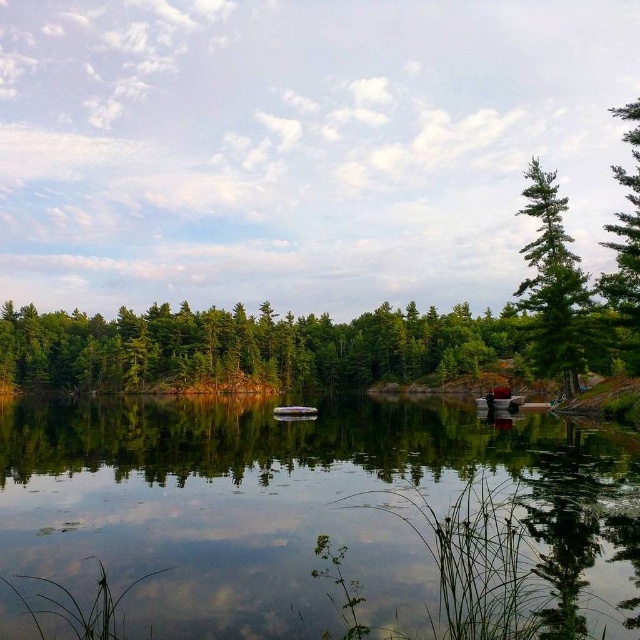
Question: Estimate the real-world distances between objects in this image. Which object is farther from the metallic silver boat at center?

Choices:
 (A) clear glass water at center
 (B) metallic red boat at lower right
 (C) green textured pine tree at upper right

Answer: (C)

Question: Which point is farther from the camera taking this photo?

Choices:
 (A) (563, 356)
 (B) (132, 385)
 (C) (480, 397)
 (D) (396, 458)

Answer: (B)

Question: Is green textured trees at left positioned at the back of metallic red boat at lower right?

Choices:
 (A) no
 (B) yes

Answer: (A)

Question: Is green textured pine tree at upper right smaller than metallic red boat at lower right?

Choices:
 (A) yes
 (B) no

Answer: (B)

Question: Does green textured pine tree at upper right have a lesser width compared to metallic silver boat at center?

Choices:
 (A) no
 (B) yes

Answer: (A)

Question: Which is nearer to the metallic red boat at lower right?

Choices:
 (A) metallic silver boat at center
 (B) green textured pine tree at upper right
 (C) green textured trees at left

Answer: (B)